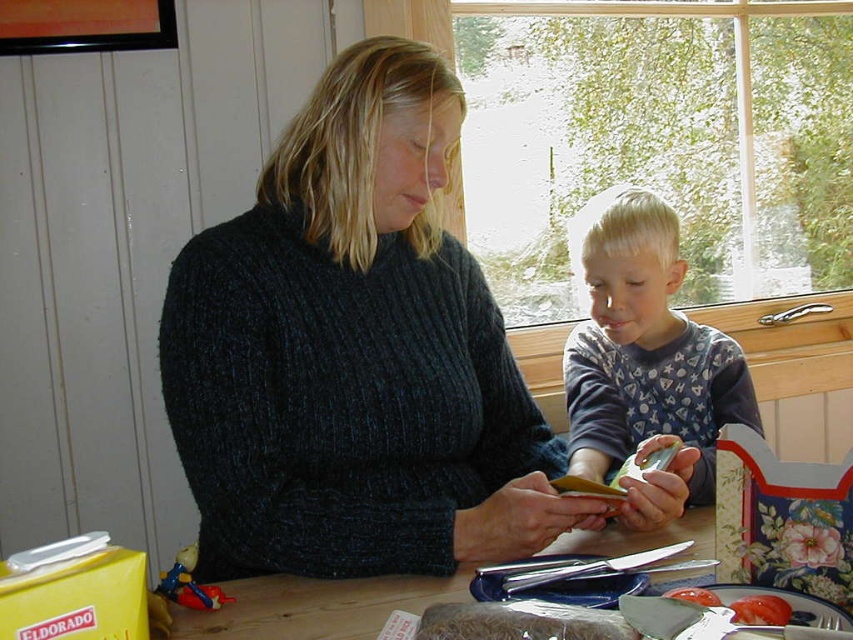
Question: Can you confirm if dark blue knitted sweater at center is positioned to the right of tomatosmoothfood at right?

Choices:
 (A) yes
 (B) no

Answer: (B)

Question: Which of these objects is positioned closest to the blue cotton shirt at center?

Choices:
 (A) dark blue knitted sweater at center
 (B) tomatosmoothfood at right
 (C) smooth tomato at lower right

Answer: (A)

Question: Which of the following is the farthest from the observer?

Choices:
 (A) dark blue knitted sweater at center
 (B) blue cotton shirt at center
 (C) tomatosmoothfood at right

Answer: (B)

Question: Which object appears closest to the camera in this image?

Choices:
 (A) blue cotton shirt at center
 (B) smooth tomato at lower right
 (C) wooden table at center
 (D) dark blue knitted sweater at center

Answer: (B)

Question: Observing the image, what is the correct spatial positioning of smooth tomato at lower right in reference to tomatosmoothfood at right?

Choices:
 (A) above
 (B) below

Answer: (A)

Question: Can you confirm if blue cotton shirt at center is positioned below wooden table at center?

Choices:
 (A) yes
 (B) no

Answer: (B)